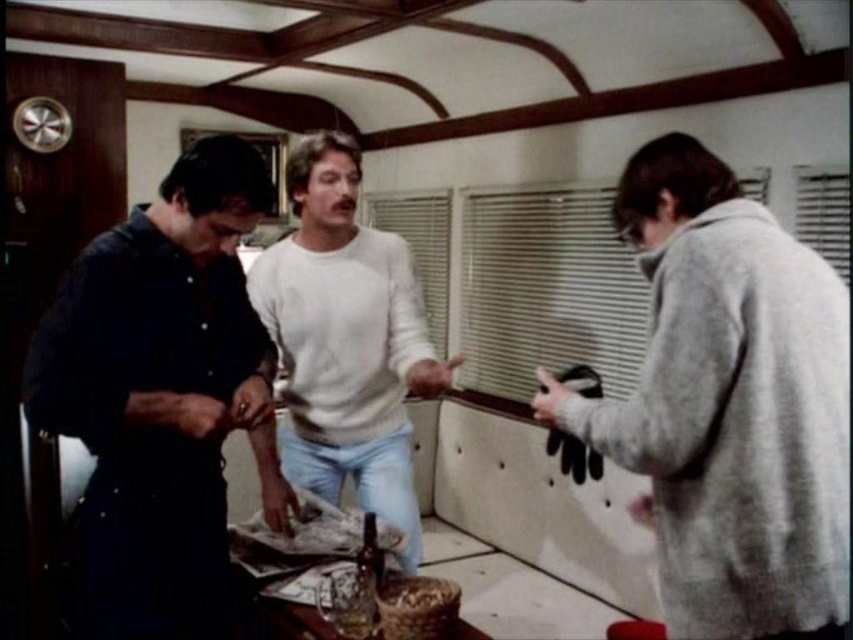
You are standing in the room and want to hand a book to the person wearing the dark blue shirt at left. If your arm can reach 1.2 meters, can you reach them without moving?

The dark blue shirt at left is 1.26 meters away from you, so your arm can only reach 1.2 meters. Therefore, you cannot reach them without moving closer.